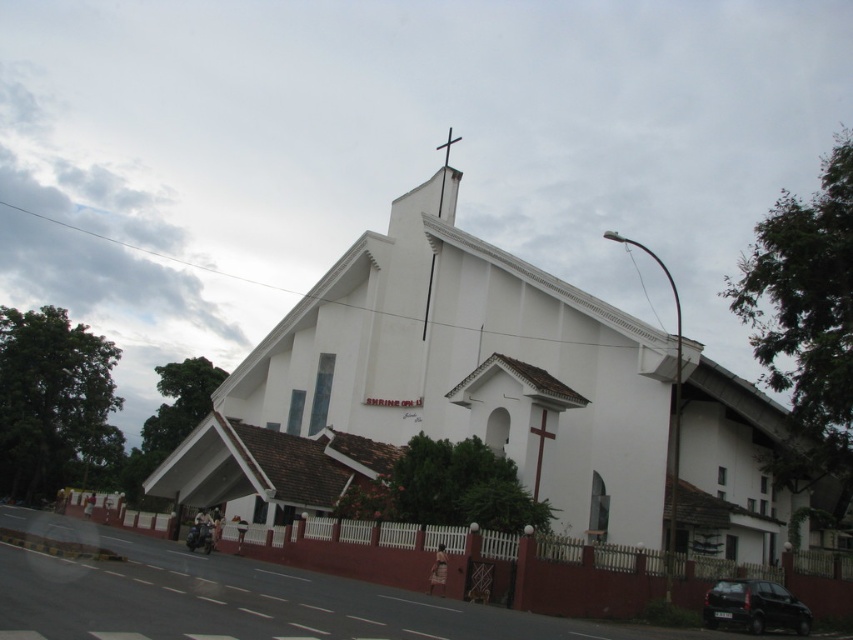
Is black matte car at lower right bigger than white wooden cross at upper center?

No, black matte car at lower right is not bigger than white wooden cross at upper center.

Is black matte car at lower right positioned at the back of white wooden cross at upper center?

No, it is not.

Is point (787, 611) less distant than point (436, 145)?

Yes, it is in front of point (436, 145).

Identify the location of black matte car at lower right. Image resolution: width=853 pixels, height=640 pixels. (753, 605).

In the scene shown: Is the position of white smooth church at center more distant than that of white smooth cross at upper center?

That is False.

Is white smooth church at center bigger than white smooth cross at upper center?

Correct, white smooth church at center is larger in size than white smooth cross at upper center.

Where is `white smooth church at center`? The height and width of the screenshot is (640, 853). white smooth church at center is located at coordinates (547, 385).

Measure the distance from white smooth church at center to black matte car at lower right.

white smooth church at center is 84.87 feet from black matte car at lower right.

This screenshot has width=853, height=640. In order to click on white smooth church at center in this screenshot , I will do `click(547, 385)`.

At what (x,y) coordinates should I click in order to perform the action: click on white smooth church at center. Please return your answer as a coordinate pair (x, y). Looking at the image, I should click on (547, 385).